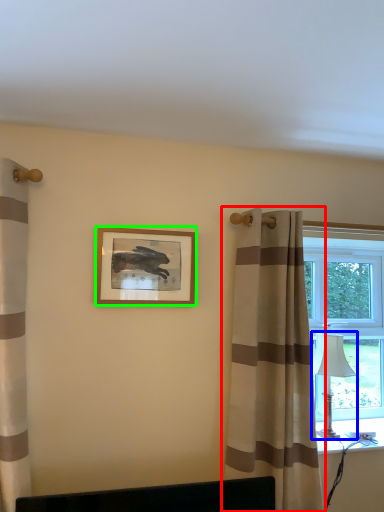
Question: Which object is positioned farthest from curtain (highlighted by a red box)? Select from table lamp (highlighted by a blue box) and picture frame (highlighted by a green box).

Choices:
 (A) table lamp
 (B) picture frame

Answer: (B)